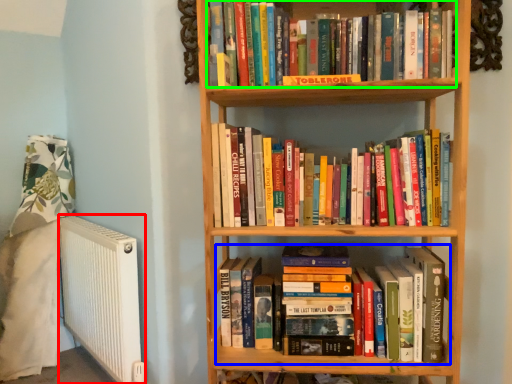
Question: Estimate the real-world distances between objects in this image. Which object is closer to radiator (highlighted by a red box), book (highlighted by a blue box) or book (highlighted by a green box)?

Choices:
 (A) book
 (B) book

Answer: (A)